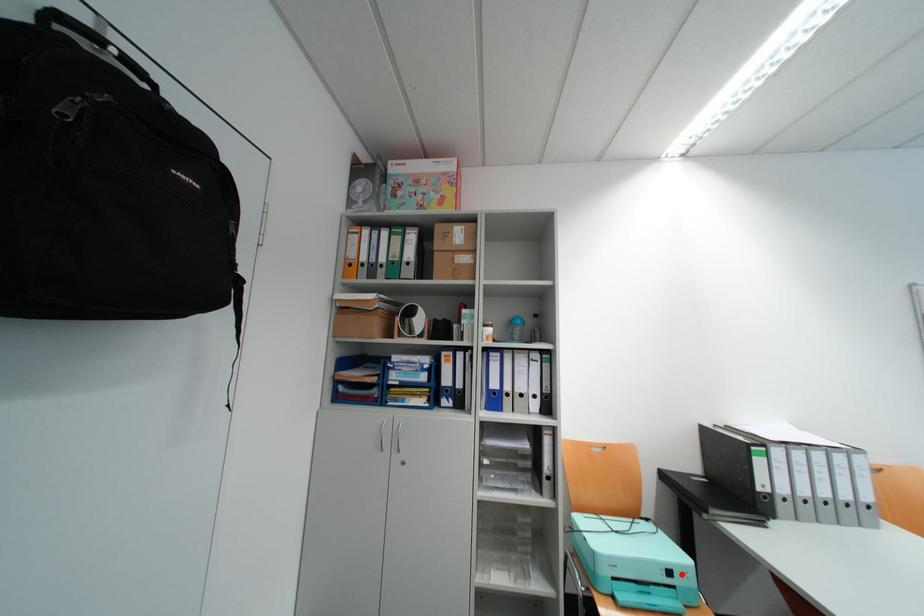
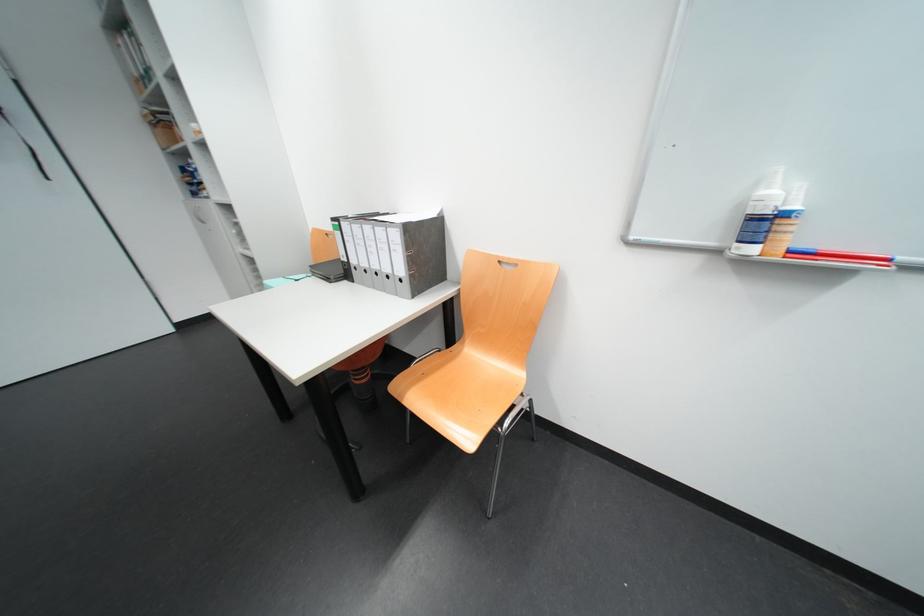
Question: I am providing you with two images of the same scene from different viewpoints. A red point is marked on the first image. At the location where the point appears in image 1, is it still visible in image 2?

Choices:
 (A) Yes
 (B) No

Answer: (B)